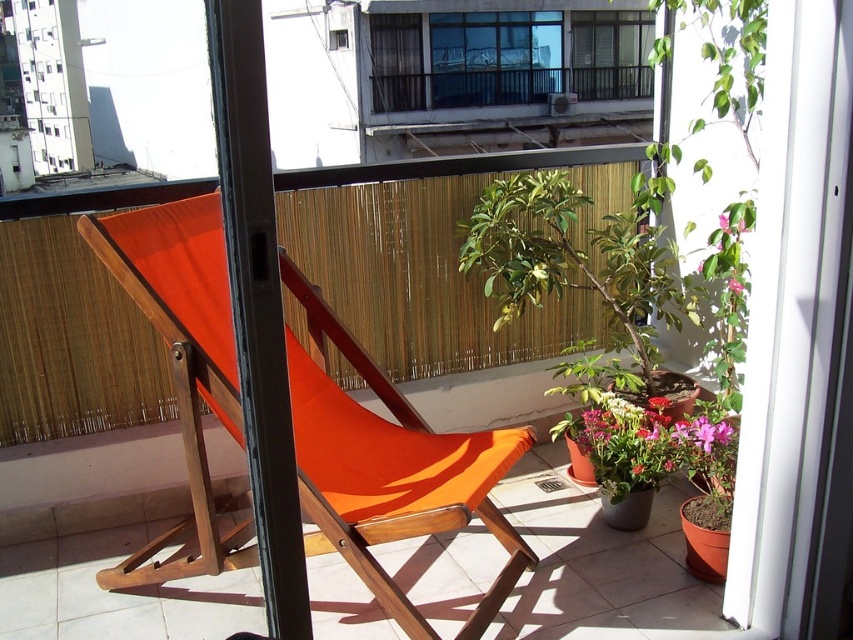
In the scene shown: Is the position of transparent glass window at upper center less distant than that of clear glass window at upper center?

That is True.

Which of these two, transparent glass window at upper center or clear glass window at upper center, stands taller?

transparent glass window at upper center

Does point (440, 17) come behind point (631, 70)?

No, (440, 17) is closer to viewer.

This screenshot has width=853, height=640. Find the location of `transparent glass window at upper center`. transparent glass window at upper center is located at coordinates (494, 58).